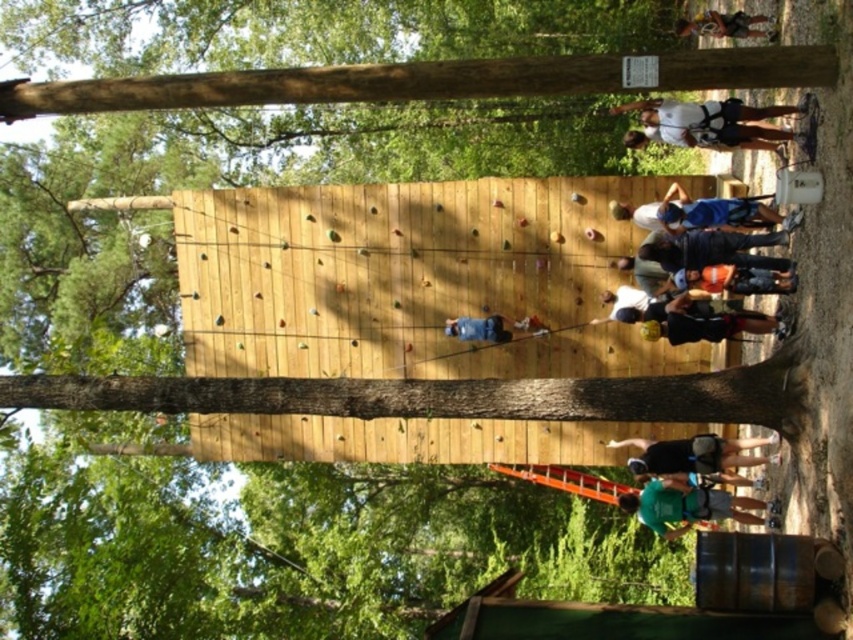
You are a photographer standing at the base of the climbing wall. You want to capture a photo of the two climbers wearing the white matte shirt at upper right and dark blue shirt at upper right. Which climber should you adjust your camera to focus on first if you want to capture them from left to right in the photo?

You should focus on the white matte shirt at upper right first because it is positioned to the left of the dark blue shirt at upper right, so capturing them left to right would start with the white one.

You are standing at the base of the climbing wall and want to reach the top. You notice two points marked on the wall. The first point is at coordinates point (685, 317) and the second is at point (729, 33). Which point is closer to you as you face the climbing wall?

Point (685, 317) is in front of point (729, 33), so the first point is closer to you as you face the climbing wall.